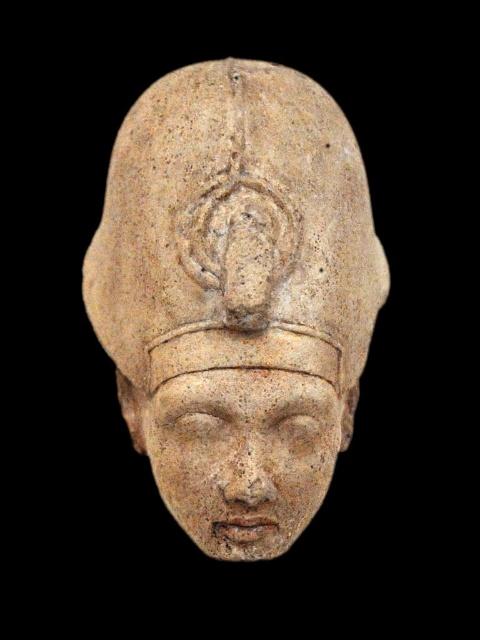
You are an archaeologist examining the stone sculpture. You notice two parts of the sculpture labeled as the beige stone head at center and the matte stone face at center. Which part is taller?

The beige stone head at center is taller than the matte stone face at center.

You are an archaeologist examining the sculpture. You notice two parts of the sculpture labeled as beige stone head at center and matte stone face at center. Which one is positioned to the left?

The beige stone head at center is positioned to the left of the matte stone face at center.

You are an archaeologist examining the stone sculpture of the head. You notice two points on the sculpture labeled as point (337, 166) and point (216, 554). Which of these points is closer to the front of the sculpture?

Point (337, 166) is further to the camera than point (216, 554), so point (216, 554) is closer to the front of the sculpture.